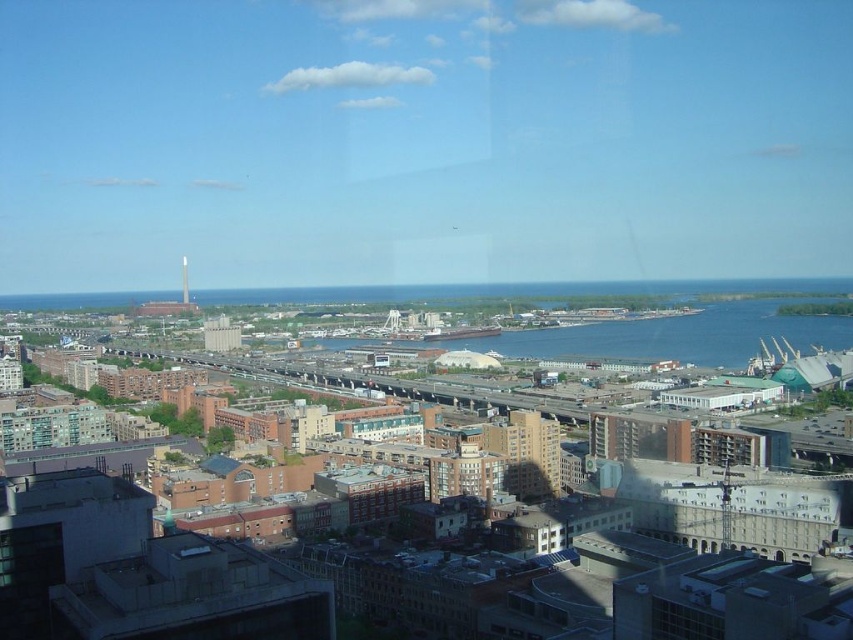
Question: Does beige concrete building at center lie behind white glossy tower at center?

Choices:
 (A) yes
 (B) no

Answer: (B)

Question: Does beige concrete building at center appear over white glossy tower at center?

Choices:
 (A) yes
 (B) no

Answer: (B)

Question: Among these objects, which one is nearest to the camera?

Choices:
 (A) beige concrete building at center
 (B) white glossy tower at center

Answer: (A)

Question: Is beige concrete building at center positioned in front of white glossy tower at center?

Choices:
 (A) no
 (B) yes

Answer: (B)

Question: Which of the following is the closest to the observer?

Choices:
 (A) (541, 422)
 (B) (181, 266)

Answer: (A)